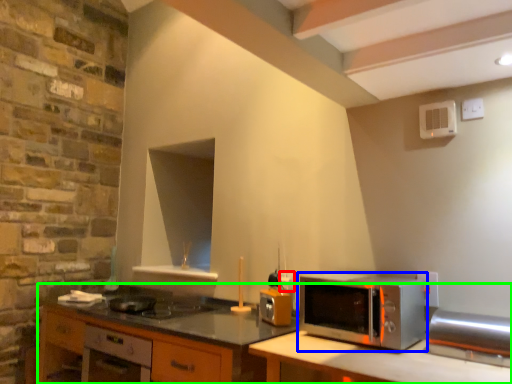
Question: Considering the real-world distances, which object is closest to electric outlet (highlighted by a red box)? microwave oven (highlighted by a blue box) or cabinetry (highlighted by a green box).

Choices:
 (A) microwave oven
 (B) cabinetry

Answer: (A)